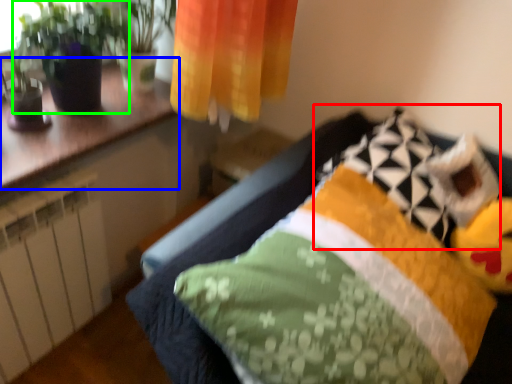
Question: Based on their relative distances, which object is farther from pillow (highlighted by a red box)? Choose from counter top (highlighted by a blue box) and houseplant (highlighted by a green box).

Choices:
 (A) counter top
 (B) houseplant

Answer: (B)